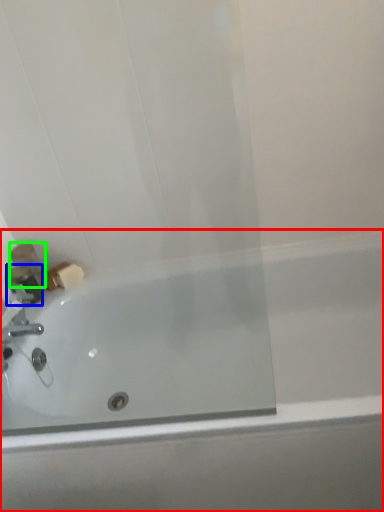
Question: Based on their relative distances, which object is farther from bathtub (highlighted by a red box)? Choose from toiletry (highlighted by a blue box) and toiletry (highlighted by a green box).

Choices:
 (A) toiletry
 (B) toiletry

Answer: (B)